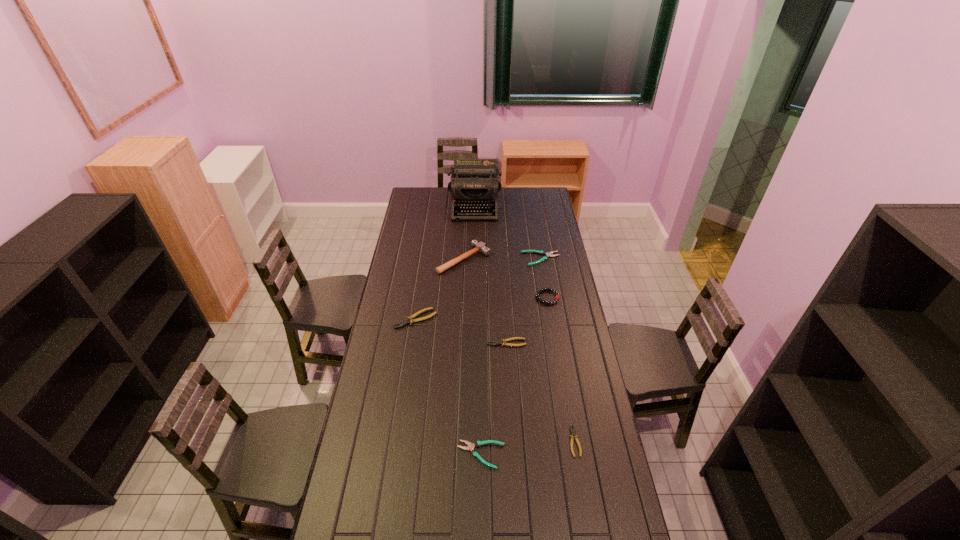
I want to click on unoccupied position between the nearest yellow pliers and the third nearest object, so click(x=540, y=392).

At what (x,y) coordinates should I click in order to perform the action: click on empty location between the leftmost yellow pliers and the right teal pliers. Please return your answer as a coordinate pair (x, y). Looking at the image, I should click on (478, 289).

This screenshot has width=960, height=540. I want to click on blank region between the left teal pliers and the hammer, so click(472, 357).

Identify the location of free spot between the second tallest object and the right teal pliers. point(502,259).

Where is `empty location between the second yellow pliers from left to right and the bracelet`? empty location between the second yellow pliers from left to right and the bracelet is located at coordinates (527, 320).

Where is `free space between the smaller teal pliers and the second nearest yellow pliers`? The height and width of the screenshot is (540, 960). free space between the smaller teal pliers and the second nearest yellow pliers is located at coordinates (494, 399).

This screenshot has width=960, height=540. What are the coordinates of `object identified as the second closest to the tallest object` in the screenshot? It's located at (549, 254).

Identify which object is the sixth closest to the smallest yellow pliers. Please provide its 2D coordinates. Your answer should be formatted as a tuple, i.e. [(x, y)], where the tuple contains the x and y coordinates of a point satisfying the conditions above.

[(549, 254)]

Find the location of `pliers that is the third closest one to the typewriter`. pliers that is the third closest one to the typewriter is located at coordinates [x=504, y=341].

Identify which pliers is the fourth nearest to the typewriter. Please provide its 2D coordinates. Your answer should be formatted as a tuple, i.e. [(x, y)], where the tuple contains the x and y coordinates of a point satisfying the conditions above.

[(573, 435)]